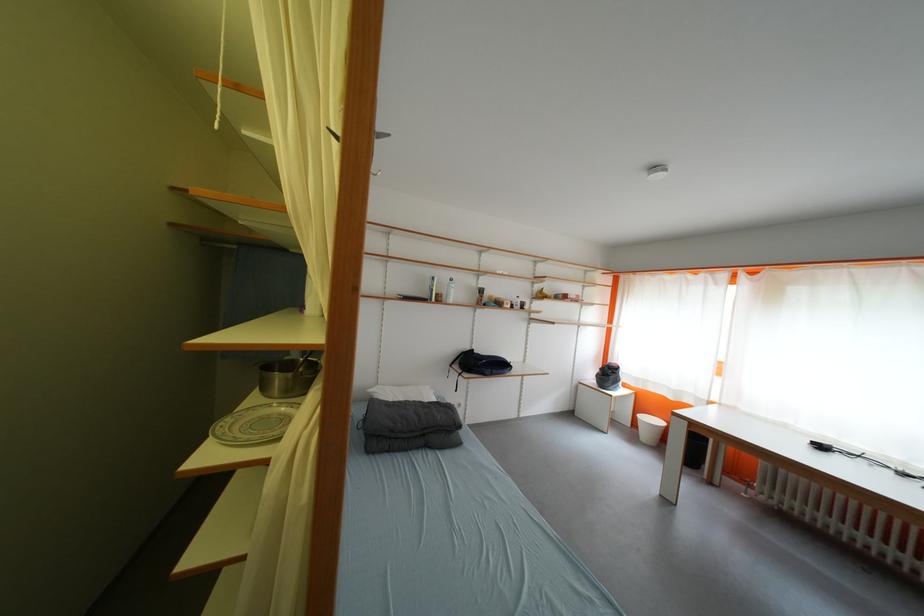
Where is `grey folded blanket`? grey folded blanket is located at coordinates (408, 426).